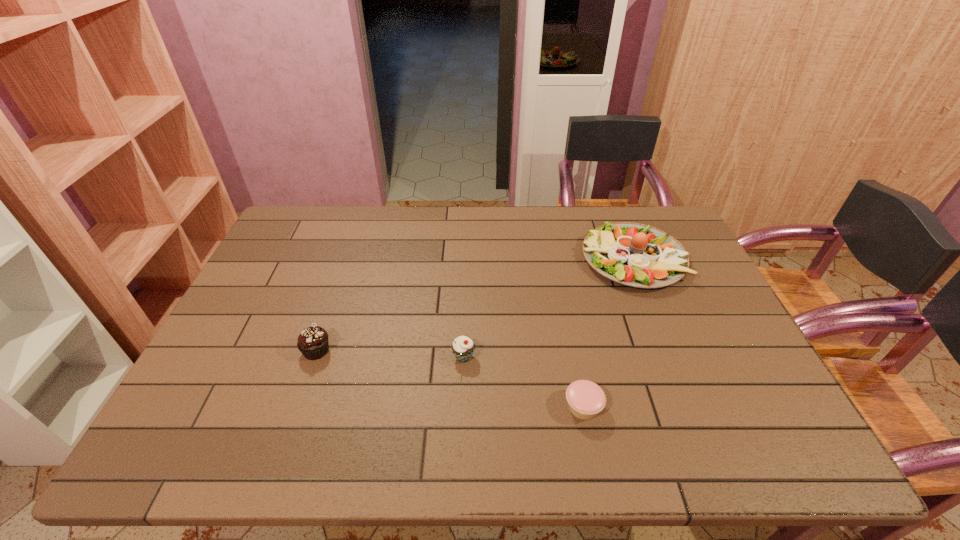
Image resolution: width=960 pixels, height=540 pixels. Find the location of `salad plate`. salad plate is located at coordinates (637, 255).

I want to click on the farthest object, so click(x=637, y=255).

Locate an element on the screen. This screenshot has height=540, width=960. the second cupcake from left to right is located at coordinates (463, 347).

Where is `the leftmost cupcake`? the leftmost cupcake is located at coordinates (313, 343).

In order to click on the rightmost cupcake in this screenshot , I will do `click(586, 399)`.

At what (x,y) coordinates should I click in order to perform the action: click on the third object from left to right. Please return your answer as a coordinate pair (x, y). The height and width of the screenshot is (540, 960). Looking at the image, I should click on point(586,399).

Identify the location of free point located on the left of the rightmost object. This screenshot has height=540, width=960. (561, 259).

This screenshot has height=540, width=960. In order to click on free region located 0.140m on the right of the second cupcake from left to right in this screenshot , I will do `click(531, 357)`.

This screenshot has height=540, width=960. In order to click on free region located 0.180m on the back of the leftmost object in this screenshot , I will do `click(337, 292)`.

You are a GUI agent. You are given a task and a screenshot of the screen. Output one action in this format:
    pyautogui.click(x=<x>, y=<y>)
    Task: Click on the vacant region located 0.400m on the right of the third object from left to right
    
    Given the screenshot: What is the action you would take?
    pyautogui.click(x=775, y=407)